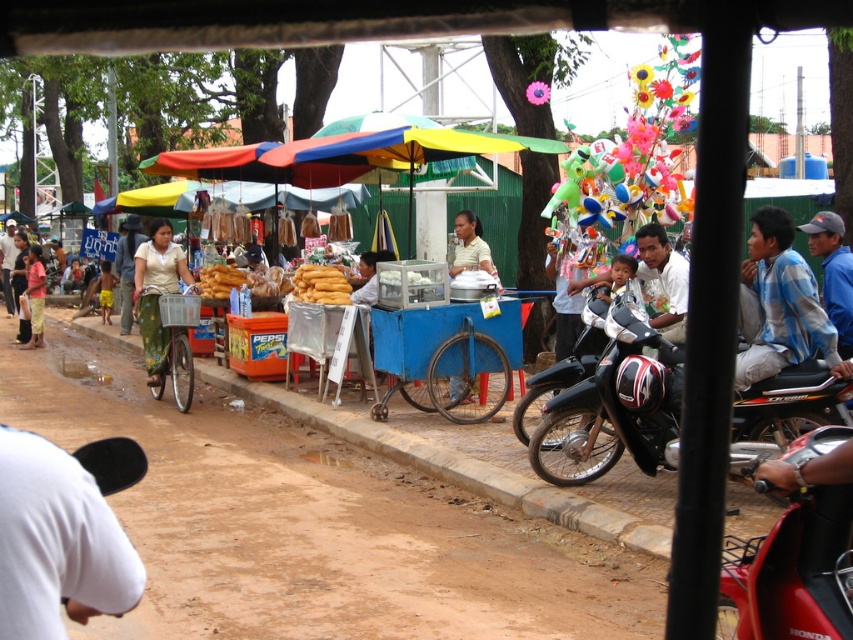
Which of these two, blue plaid shirt at right or light brown fabric shirt at center, stands shorter?

blue plaid shirt at right

Can you confirm if blue plaid shirt at right is positioned to the right of light brown fabric shirt at center?

Indeed, blue plaid shirt at right is positioned on the right side of light brown fabric shirt at center.

Is point (781, 317) farther from camera compared to point (120, 292)?

No.

Identify the location of blue plaid shirt at right. (778, 304).

Can you confirm if black matte motorcycle at right is shorter than blue fabric cap at upper right?

In fact, black matte motorcycle at right may be taller than blue fabric cap at upper right.

Is black matte motorcycle at right below blue fabric cap at upper right?

Indeed, black matte motorcycle at right is positioned under blue fabric cap at upper right.

Find the location of a particular element. black matte motorcycle at right is located at coordinates (613, 406).

Is black matte motorcycle at right positioned behind white matte shirt at center?

No, it is not.

Who is more forward, (x=749, y=426) or (x=653, y=268)?

Positioned in front is point (x=749, y=426).

Where is `black matte motorcycle at right`? Image resolution: width=853 pixels, height=640 pixels. black matte motorcycle at right is located at coordinates (613, 406).